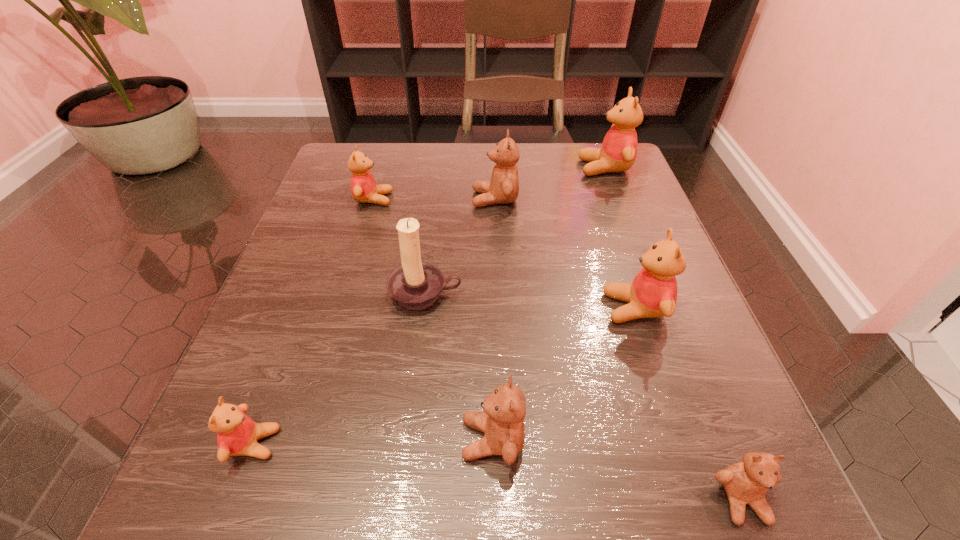
You are a GUI agent. You are given a task and a screenshot of the screen. Output one action in this format:
    pyautogui.click(x=<x>, y=<y>)
    Task: Click on the third closest red teddy bear relative to the third nearest red teddy bear
    The height and width of the screenshot is (540, 960).
    Given the screenshot: What is the action you would take?
    pyautogui.click(x=237, y=434)

Identify which red teddy bear is the third nearest to the rightmost brown teddy bear. Please provide its 2D coordinates. Your answer should be formatted as a tuple, i.e. [(x, y)], where the tuple contains the x and y coordinates of a point satisfying the conditions above.

[(618, 152)]

Identify which brown teddy bear is the nearest to the farthest red teddy bear. Please provide its 2D coordinates. Your answer should be formatted as a tuple, i.e. [(x, y)], where the tuple contains the x and y coordinates of a point satisfying the conditions above.

[(503, 188)]

The image size is (960, 540). I want to click on brown teddy bear that stands as the closest to the smallest brown teddy bear, so click(502, 421).